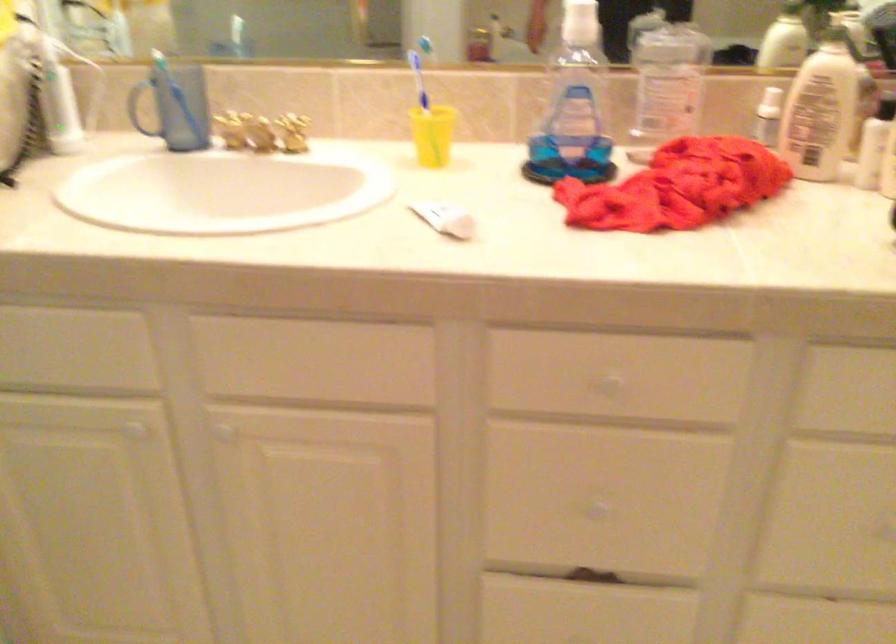
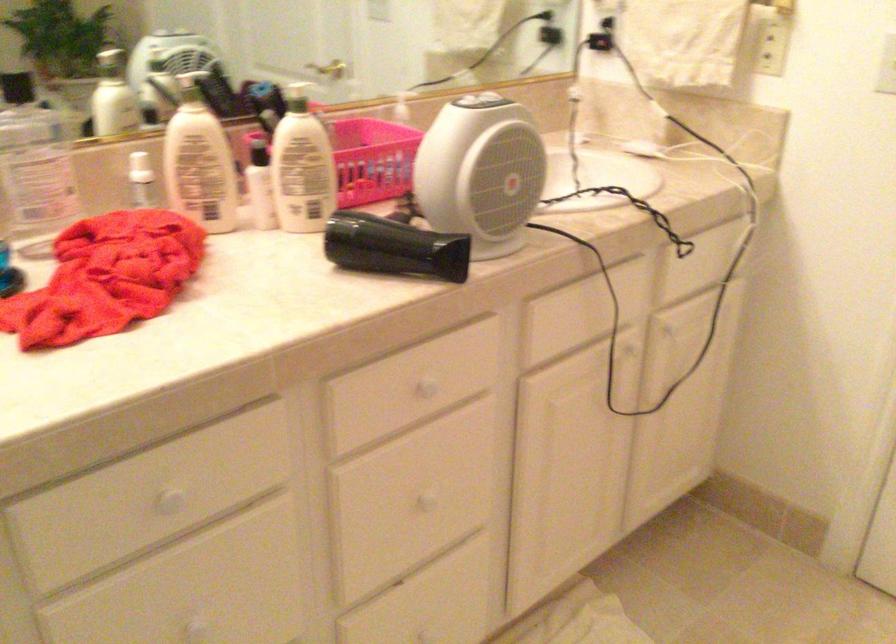
Find the pixel in the second image that matches (616,388) in the first image.

(169, 500)